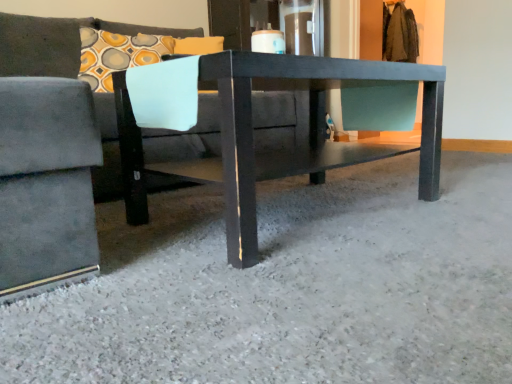
Question: From a real-world perspective, is velvet gray couch at center positioned above or below matte black table at center?

Choices:
 (A) above
 (B) below

Answer: (A)

Question: Is velvet gray couch at center taller or shorter than matte black table at center?

Choices:
 (A) tall
 (B) short

Answer: (A)

Question: Based on their relative distances, which object is farther from the velvet gray couch at center?

Choices:
 (A) matte black table at center
 (B) smooth gray carpet at center

Answer: (B)

Question: Estimate the real-world distances between objects in this image. Which object is closer to the smooth gray carpet at center?

Choices:
 (A) velvet gray couch at center
 (B) matte black table at center

Answer: (B)